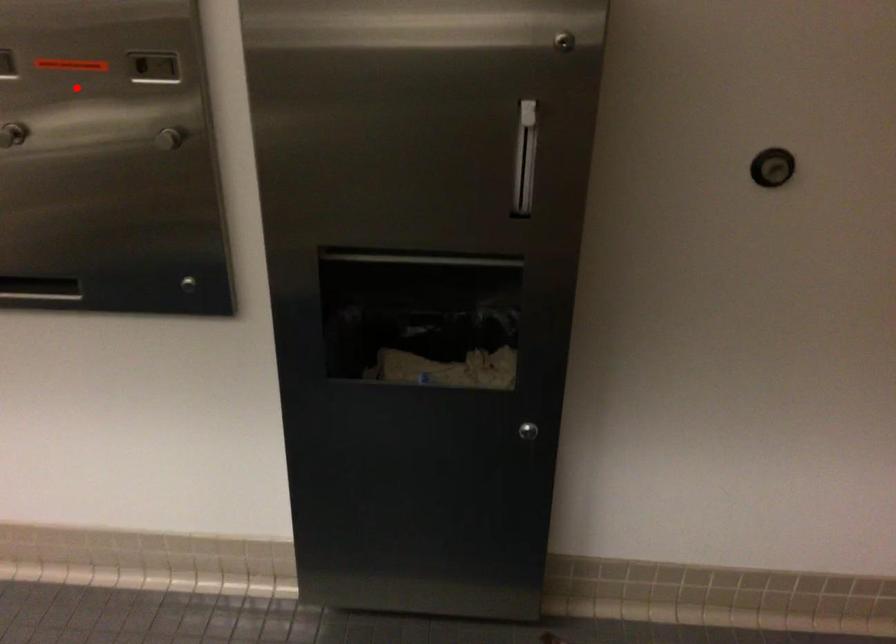
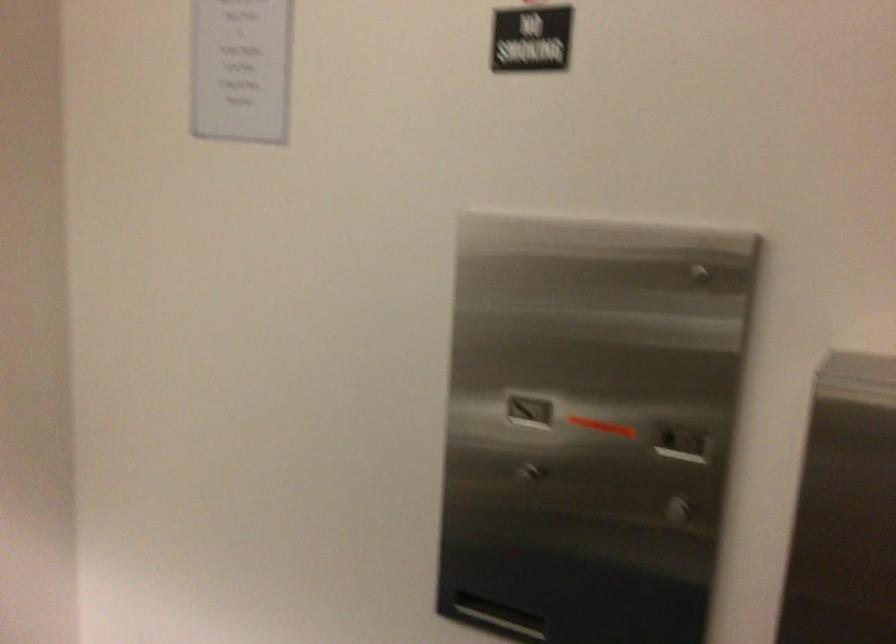
Find the pixel in the second image that matches the highlighted location in the first image.

(600, 424)